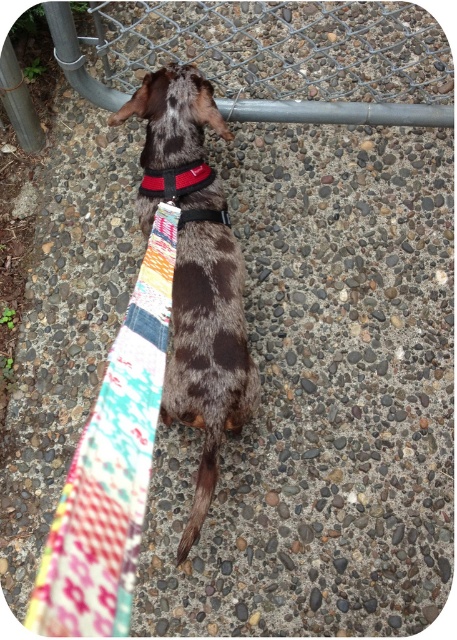
You are a photographer setting up a photo shoot for a pet magazine. You need to ensure that the spotted fur dog at center and the patchwork fabric tie at lower left are both in frame. Given that the camera can only focus on objects taller than 15 cm, will both objects be in focus?

The spotted fur dog at center is taller than the patchwork fabric tie at lower left. Since the camera focuses on objects taller than 15 cm, the dog will be in focus. However, the tie may not meet the height requirement if it is shorter than 15 cm. Without specific measurements, we can only confirm the dog is in focus.

You are holding a camera and want to know the distance to the point marked as point (129,538) in the image. Can you determine how far it is from the camera?

The point (129,538) is 28.34 inches from the camera.

You are a dog owner who wants to attach a tag to the taller object between the red fabric neckband at center and the black fabric strap at center. Which object should you choose?

The red fabric neckband at center is taller than the black fabric strap at center, so you should attach the tag to the red fabric neckband at center.